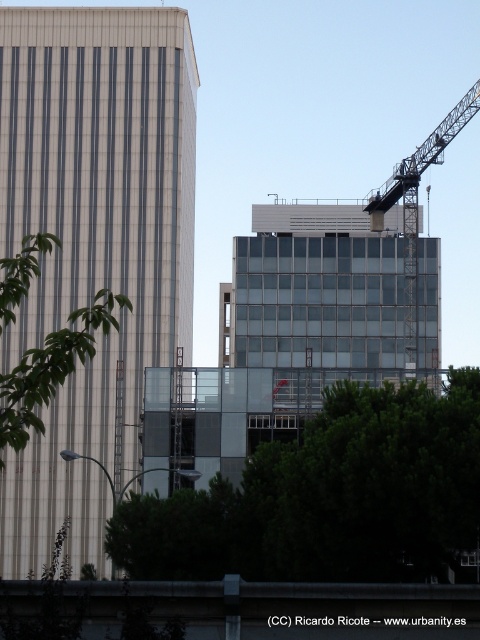
Question: Which of the following is the farthest from the observer?

Choices:
 (A) (43, 349)
 (B) (162, 45)
 (C) (409, 557)
 (D) (477, 99)

Answer: (B)

Question: Can you confirm if green leafy tree at left is smaller than metallic gray crane at upper right?

Choices:
 (A) no
 (B) yes

Answer: (A)

Question: Does green leafy tree at center have a larger size compared to green leafy tree at left?

Choices:
 (A) no
 (B) yes

Answer: (A)

Question: Is green leafy tree at left wider than metallic gray crane at upper right?

Choices:
 (A) no
 (B) yes

Answer: (B)

Question: Which object appears closest to the camera in this image?

Choices:
 (A) metallic gray crane at upper right
 (B) green leafy tree at center
 (C) white glass building at left

Answer: (B)

Question: Based on their relative distances, which object is nearer to the green leafy tree at center?

Choices:
 (A) green leafy tree at left
 (B) white glass building at left
 (C) metallic gray crane at upper right

Answer: (A)